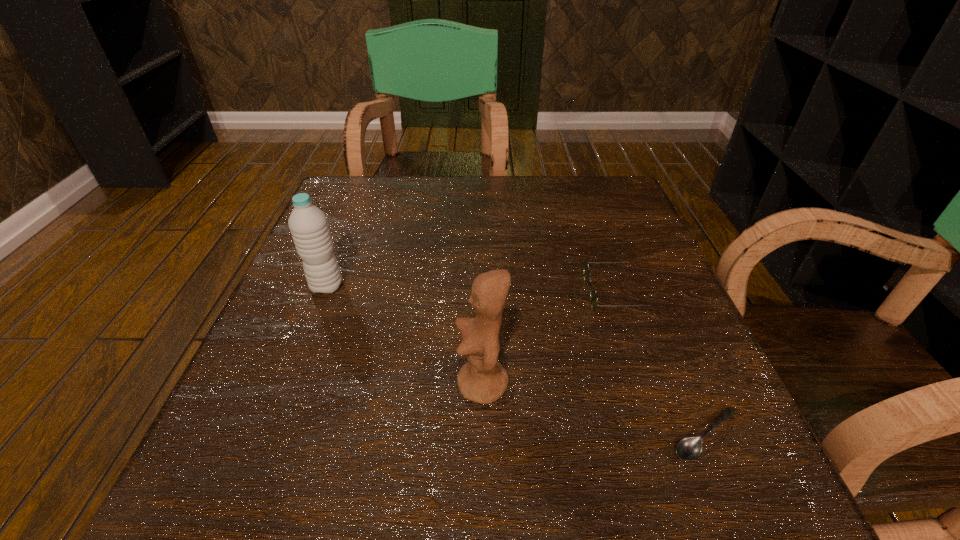
Locate an element on the screen. This screenshot has height=540, width=960. figurine is located at coordinates (483, 379).

At what (x,y) coordinates should I click in order to perform the action: click on water bottle. Please return your answer as a coordinate pair (x, y). The width and height of the screenshot is (960, 540). Looking at the image, I should click on (308, 225).

This screenshot has height=540, width=960. I want to click on sunglasses, so click(x=593, y=294).

You are a GUI agent. You are given a task and a screenshot of the screen. Output one action in this format:
    pyautogui.click(x=<x>, y=<y>)
    Task: Click on the shortest object
    This screenshot has height=540, width=960.
    Given the screenshot: What is the action you would take?
    pyautogui.click(x=690, y=448)

Locate an element on the screen. The height and width of the screenshot is (540, 960). blank space located on the front-facing side of the figurine is located at coordinates (318, 384).

You are a GUI agent. You are given a task and a screenshot of the screen. Output one action in this format:
    pyautogui.click(x=<x>, y=<y>)
    Task: Click on the free spot located on the front-facing side of the figurine
    
    Given the screenshot: What is the action you would take?
    350,384

Where is `vacant space situated on the front-facing side of the figurine`? Image resolution: width=960 pixels, height=540 pixels. vacant space situated on the front-facing side of the figurine is located at coordinates (338, 384).

Image resolution: width=960 pixels, height=540 pixels. I want to click on blank space located on the front of the leftmost object, so click(x=273, y=427).

Locate an element on the screen. free space located on the front-facing side of the sunglasses is located at coordinates (409, 293).

Where is `free location located 0.140m on the front-facing side of the sunglasses`? The height and width of the screenshot is (540, 960). free location located 0.140m on the front-facing side of the sunglasses is located at coordinates (512, 293).